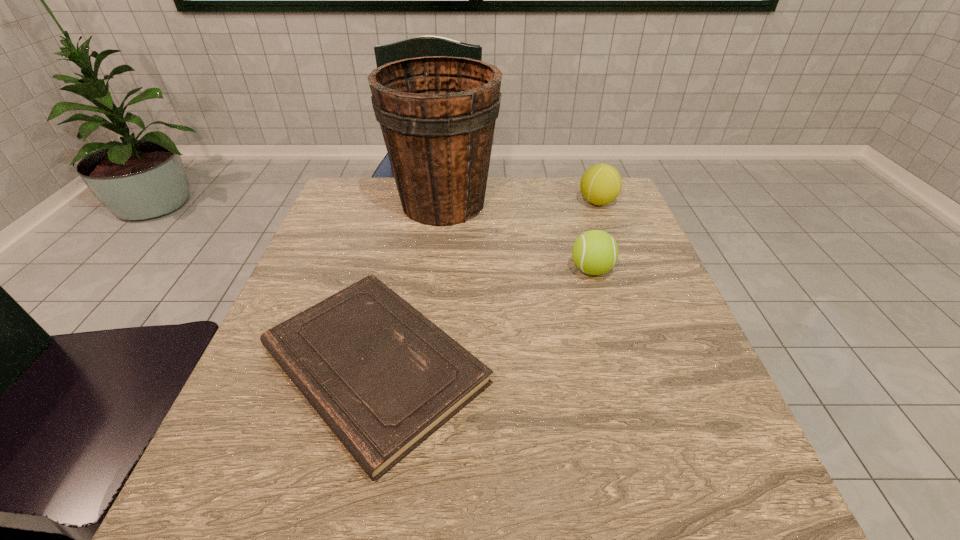
Identify the location of free space at the right edge of the desktop. (670, 327).

You are a GUI agent. You are given a task and a screenshot of the screen. Output one action in this format:
    pyautogui.click(x=<x>, y=<y>)
    Task: Click on the free location at the far left corner
    This screenshot has width=960, height=540.
    Given the screenshot: What is the action you would take?
    pyautogui.click(x=326, y=216)

Where is `free spot at the near left corner of the desktop`? The height and width of the screenshot is (540, 960). free spot at the near left corner of the desktop is located at coordinates (224, 529).

Find the location of a particular element. The image size is (960, 540). free location at the far right corner is located at coordinates (588, 212).

I want to click on unoccupied position between the farther tennis ball and the tallest object, so click(x=520, y=202).

Locate an element on the screen. The width and height of the screenshot is (960, 540). unoccupied position between the paperback book and the bucket is located at coordinates (409, 284).

Identify the location of empty location between the second nearest object and the bucket. The image size is (960, 540). (517, 237).

Where is `empty space that is in between the third farthest object and the nearest object`? This screenshot has height=540, width=960. empty space that is in between the third farthest object and the nearest object is located at coordinates (483, 318).

Find the location of a particular element. The image size is (960, 540). empty space between the shortest object and the farther tennis ball is located at coordinates (486, 284).

This screenshot has width=960, height=540. In order to click on free space between the bucket and the nearer tennis ball in this screenshot , I will do `click(517, 237)`.